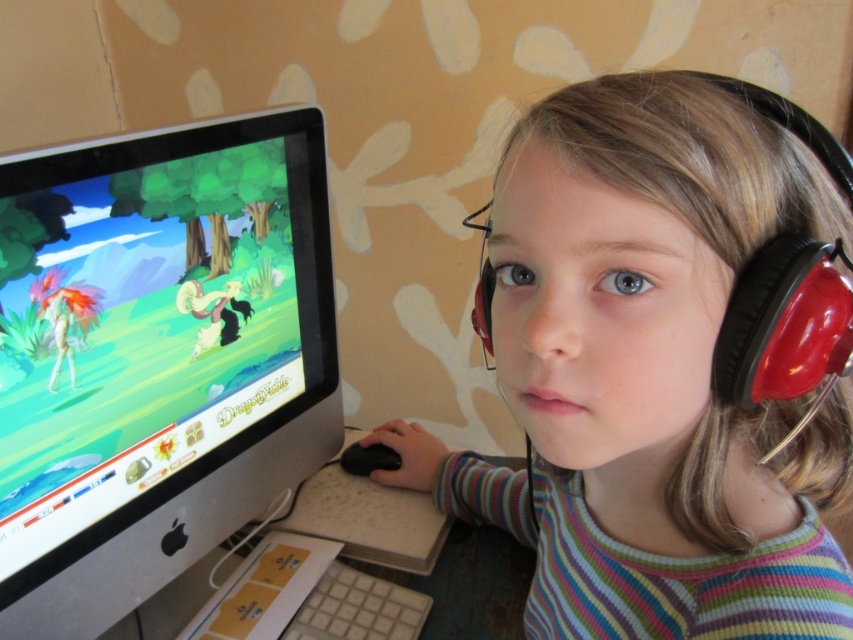
Who is higher up, black matte headphones at upper right or satin black monitor at left?

satin black monitor at left is above.

Which is below, black matte headphones at upper right or satin black monitor at left?

Positioned lower is black matte headphones at upper right.

Between point (631, 417) and point (97, 349), which one is positioned behind?

Positioned behind is point (97, 349).

Identify the location of black matte headphones at upper right. (648, 372).